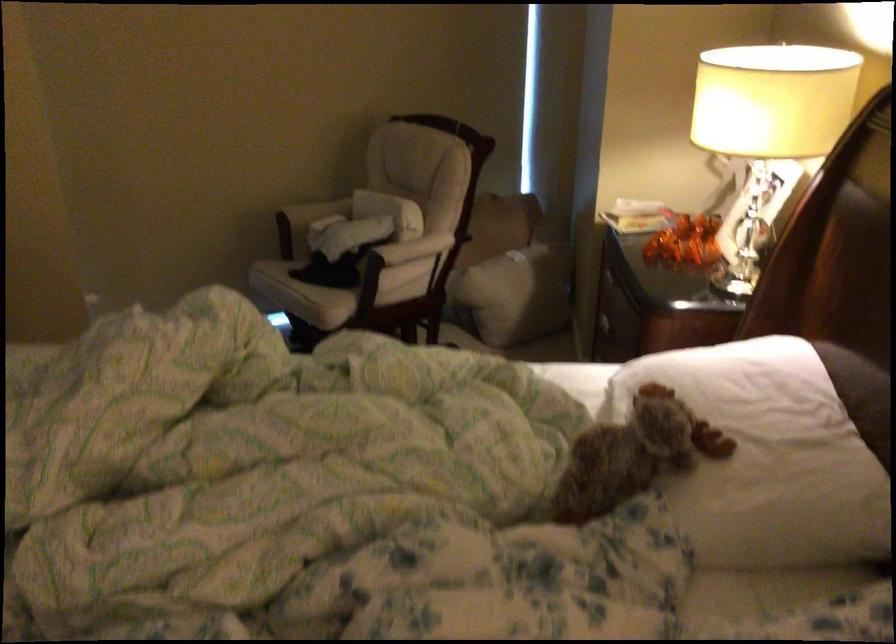
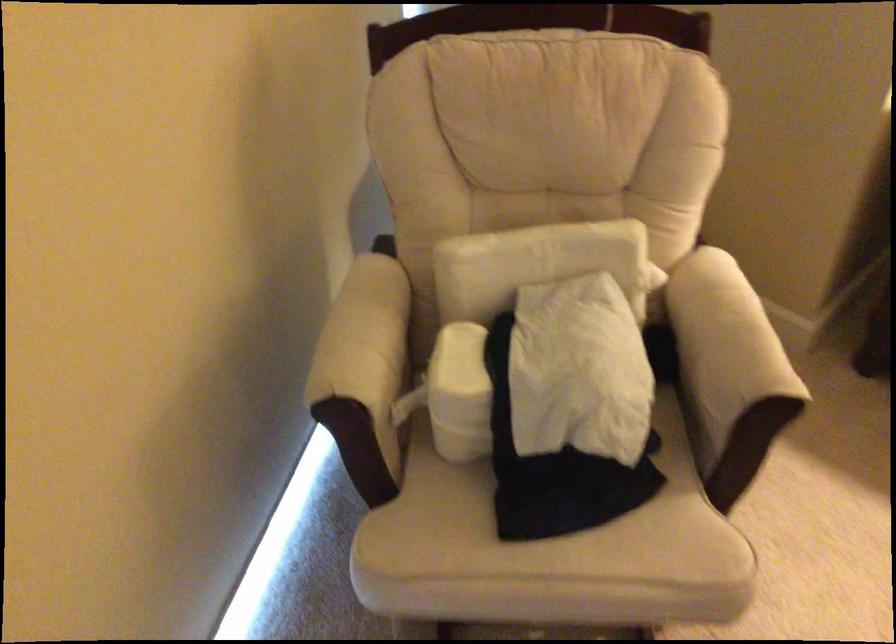
In the second image, find the point that corresponds to point (378, 202) in the first image.

(533, 263)